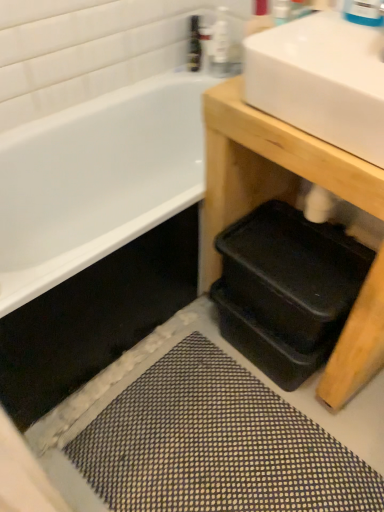
Question: From the image's perspective, is black plastic trays at lower right located above textured gray bath mat at lower center?

Choices:
 (A) yes
 (B) no

Answer: (A)

Question: Is black plastic trays at lower right at the right side of textured gray bath mat at lower center?

Choices:
 (A) no
 (B) yes

Answer: (B)

Question: Are black plastic trays at lower right and textured gray bath mat at lower center beside each other?

Choices:
 (A) yes
 (B) no

Answer: (B)

Question: Considering the relative positions of black plastic trays at lower right and textured gray bath mat at lower center in the image provided, is black plastic trays at lower right in front of textured gray bath mat at lower center?

Choices:
 (A) no
 (B) yes

Answer: (B)

Question: From the image's perspective, would you say black plastic trays at lower right is shown under textured gray bath mat at lower center?

Choices:
 (A) no
 (B) yes

Answer: (A)

Question: Do you think black plastic trays at lower right is within blue glossy faucet at upper right, or outside of it?

Choices:
 (A) outside
 (B) inside

Answer: (A)

Question: Considering their positions, is black plastic trays at lower right located in front of or behind blue glossy faucet at upper right?

Choices:
 (A) behind
 (B) front

Answer: (B)

Question: Considering the relative positions of black plastic trays at lower right and blue glossy faucet at upper right in the image provided, is black plastic trays at lower right to the left or to the right of blue glossy faucet at upper right?

Choices:
 (A) left
 (B) right

Answer: (B)

Question: Considering the positions of black plastic trays at lower right and blue glossy faucet at upper right in the image, is black plastic trays at lower right wider or thinner than blue glossy faucet at upper right?

Choices:
 (A) wide
 (B) thin

Answer: (A)

Question: From the image's perspective, is black plastic trays at lower right positioned above or below white glossy sink at upper right?

Choices:
 (A) below
 (B) above

Answer: (A)

Question: In the image, is black plastic trays at lower right positioned in front of or behind white glossy sink at upper right?

Choices:
 (A) behind
 (B) front

Answer: (A)

Question: From their relative heights in the image, would you say black plastic trays at lower right is taller or shorter than white glossy sink at upper right?

Choices:
 (A) short
 (B) tall

Answer: (B)

Question: In terms of width, does black plastic trays at lower right look wider or thinner when compared to white glossy sink at upper right?

Choices:
 (A) wide
 (B) thin

Answer: (A)

Question: From the image's perspective, is black plastic trays at lower right positioned above or below translucent plastic bottle at upper center, which ranks as the second toiletry in right-to-left order?

Choices:
 (A) above
 (B) below

Answer: (B)

Question: Do you think black plastic trays at lower right is within translucent plastic bottle at upper center, which ranks as the second toiletry in right-to-left order, or outside of it?

Choices:
 (A) outside
 (B) inside

Answer: (A)